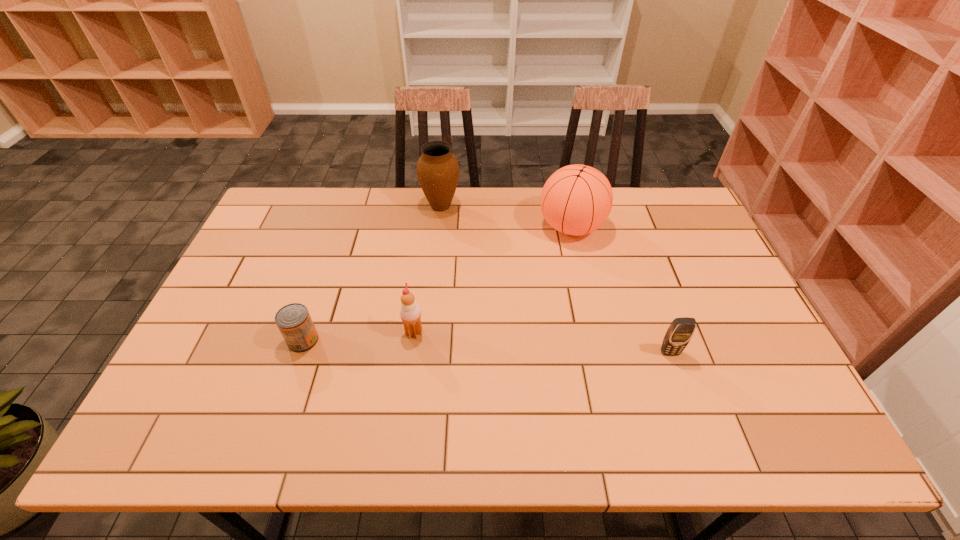
The image size is (960, 540). I want to click on urn, so click(x=437, y=170).

Find the location of a particular element. basketball is located at coordinates (576, 200).

The width and height of the screenshot is (960, 540). Identify the location of the third tallest object. (410, 312).

At what (x,y) coordinates should I click in order to perform the action: click on the fourth tallest object. Please return your answer as a coordinate pair (x, y). Looking at the image, I should click on pyautogui.click(x=681, y=330).

I want to click on cellular telephone, so click(x=681, y=330).

In order to click on the shortest object in this screenshot , I will do (x=294, y=322).

Where is `can`? can is located at coordinates (294, 322).

Locate an element on the screen. Image resolution: width=960 pixels, height=540 pixels. vacant region located 0.340m on the left of the urn is located at coordinates (323, 206).

Identify the location of free location located on the right of the basketball. (681, 227).

This screenshot has height=540, width=960. I want to click on free space located 0.390m at the front with a straw on the icecream, so click(573, 333).